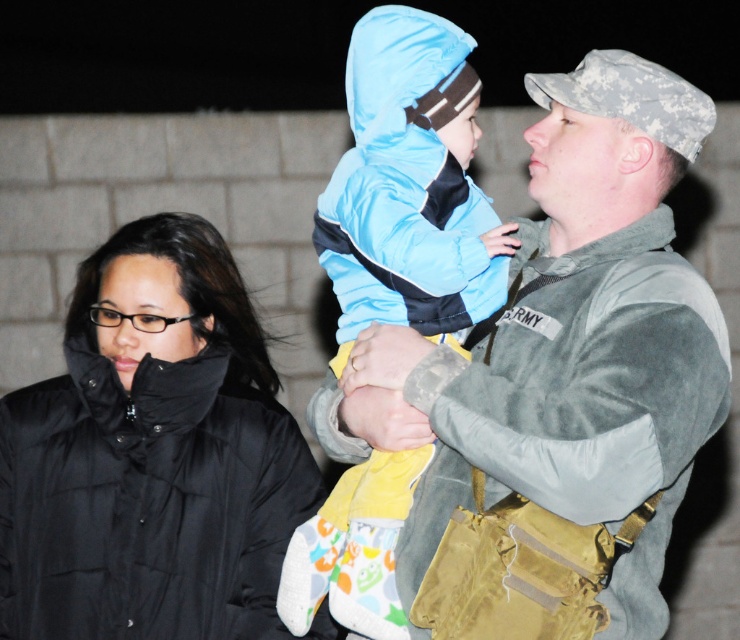
You are a fashion designer analyzing the jackets in this nighttime scene. Which jacket, the camouflage fabric jacket at center or the black puffer jacket at left, appears narrower when viewed from the front?

The camouflage fabric jacket at center has a lesser width compared to the black puffer jacket at left, so the camouflage fabric jacket at center appears narrower.

You are a photographer trying to capture a clear shot of the camouflage fabric jacket at center and the black puffer jacket at left. Since you can only focus on one subject at a time, which jacket should you choose to ensure the other remains in the background?

You should focus on the camouflage fabric jacket at center because it is in front of the black puffer jacket at left, so if you focus on the front jacket, the other will naturally be in the background.